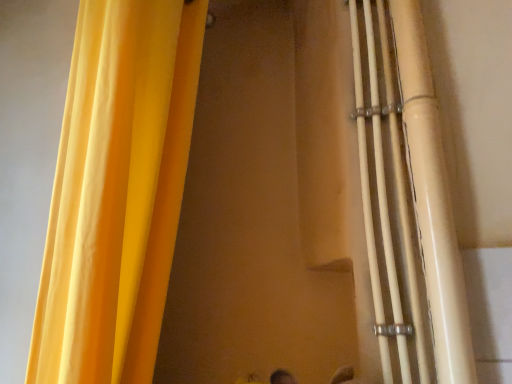
Looking at this image, what is the approximate height of matte yellow curtain at left?

matte yellow curtain at left is 1.23 meters tall.

The width and height of the screenshot is (512, 384). What do you see at coordinates (117, 191) in the screenshot? I see `matte yellow curtain at left` at bounding box center [117, 191].

This screenshot has width=512, height=384. What are the coordinates of `matte yellow curtain at left` in the screenshot? It's located at (117, 191).

This screenshot has width=512, height=384. What are the coordinates of `white glossy pipes at right` in the screenshot? It's located at (432, 200).

This screenshot has height=384, width=512. What do you see at coordinates (432, 200) in the screenshot?
I see `white glossy pipes at right` at bounding box center [432, 200].

In order to click on matte yellow curtain at left in this screenshot , I will do `click(117, 191)`.

In the image, is white glossy pipes at right on the left side or the right side of matte yellow curtain at left?

From the image, it's evident that white glossy pipes at right is to the right of matte yellow curtain at left.

Which object is further away from the camera taking this photo, white glossy pipes at right or matte yellow curtain at left?

white glossy pipes at right is more distant.

Which is less distant, (409,104) or (189,51)?

Point (409,104)

From the image's perspective, is white glossy pipes at right over matte yellow curtain at left?

No, from the image's perspective, white glossy pipes at right is not on top of matte yellow curtain at left.

From a real-world perspective, is white glossy pipes at right over matte yellow curtain at left?

No.

Which object is thinner, white glossy pipes at right or matte yellow curtain at left?

white glossy pipes at right.

Considering the relative sizes of white glossy pipes at right and matte yellow curtain at left in the image provided, is white glossy pipes at right taller than matte yellow curtain at left?

Incorrect, the height of white glossy pipes at right is not larger of that of matte yellow curtain at left.

Can you confirm if white glossy pipes at right is bigger than matte yellow curtain at left?

No, white glossy pipes at right is not bigger than matte yellow curtain at left.

Is white glossy pipes at right not inside matte yellow curtain at left?

That's correct, white glossy pipes at right is outside of matte yellow curtain at left.

Would you consider white glossy pipes at right to be distant from matte yellow curtain at left?

No.

Could you tell me if white glossy pipes at right is turned towards matte yellow curtain at left?

No, white glossy pipes at right is not turned towards matte yellow curtain at left.

At what (x,y) coordinates should I click in order to perform the action: click on curtain in front of the white glossy pipes at right. Please return your answer as a coordinate pair (x, y). The width and height of the screenshot is (512, 384). Looking at the image, I should click on (117, 191).

Which is more to the right, matte yellow curtain at left or white glossy pipes at right?

Positioned to the right is white glossy pipes at right.

Is matte yellow curtain at left positioned behind white glossy pipes at right?

No, matte yellow curtain at left is in front of white glossy pipes at right.

Is point (111, 177) more distant than point (455, 334)?

No, (111, 177) is in front of (455, 334).

From the image's perspective, is matte yellow curtain at left on white glossy pipes at right?

Yes, from the image's perspective, matte yellow curtain at left is above white glossy pipes at right.

From a real-world perspective, which object stands above the other?

In real-world perspective, matte yellow curtain at left is above.

Can you confirm if matte yellow curtain at left is wider than white glossy pipes at right?

Correct, the width of matte yellow curtain at left exceeds that of white glossy pipes at right.

Between matte yellow curtain at left and white glossy pipes at right, which one has less height?

With less height is white glossy pipes at right.

Between matte yellow curtain at left and white glossy pipes at right, which one has larger size?

Bigger between the two is matte yellow curtain at left.

Does matte yellow curtain at left contain white glossy pipes at right?

No, white glossy pipes at right is located outside of matte yellow curtain at left.

Is matte yellow curtain at left touching white glossy pipes at right?

matte yellow curtain at left and white glossy pipes at right are not in contact.

Is matte yellow curtain at left aimed at white glossy pipes at right?

Yes.

Image resolution: width=512 pixels, height=384 pixels. Identify the location of curtain located on the left of white glossy pipes at right. (117, 191).

There is a white glossy pipes at right. Find the location of `curtain above it (from a real-world perspective)`. curtain above it (from a real-world perspective) is located at coordinates (117, 191).

The image size is (512, 384). I want to click on pipe behind the matte yellow curtain at left, so click(x=432, y=200).